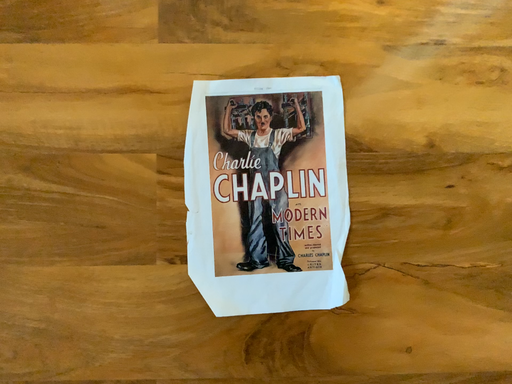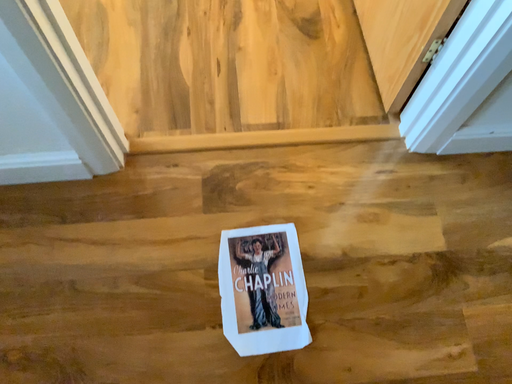
Question: Which way did the camera rotate in the video?

Choices:
 (A) rotated downward
 (B) rotated upward

Answer: (B)